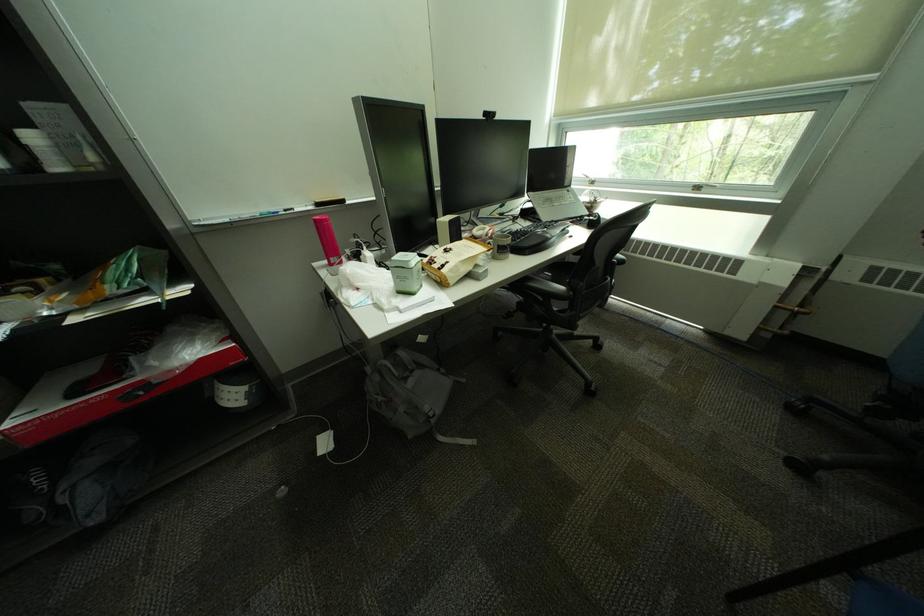
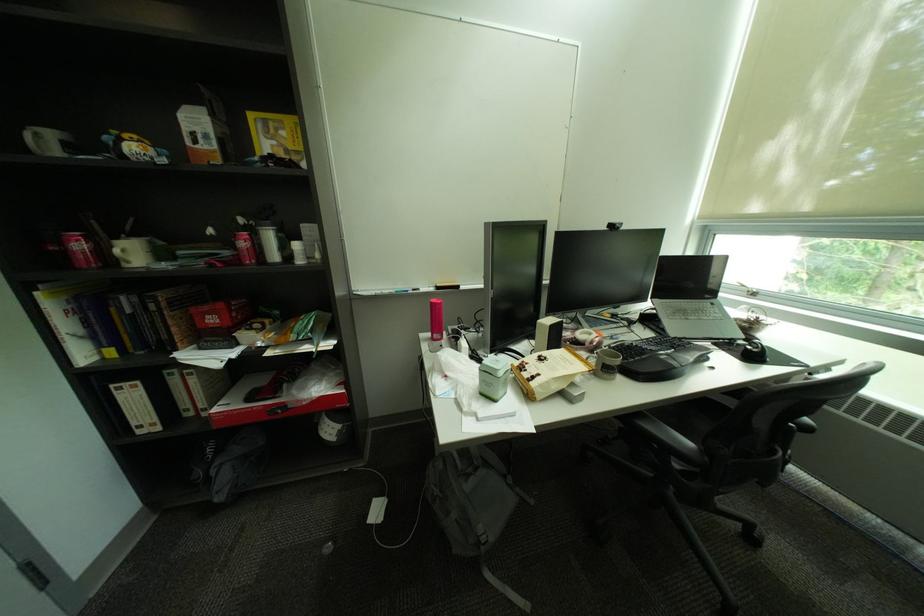
The point at (563, 302) is marked in the first image. Where is the corresponding point in the second image?

(684, 458)